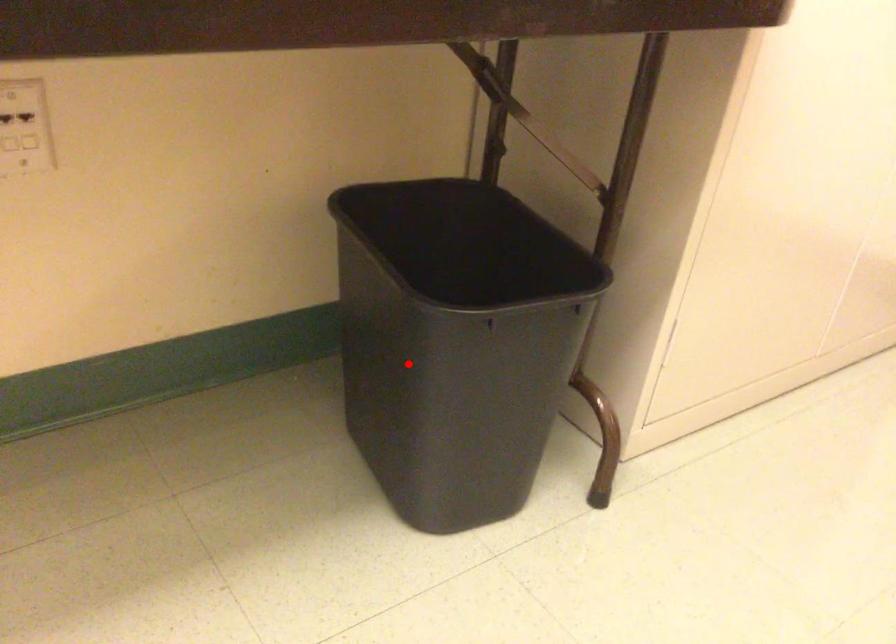
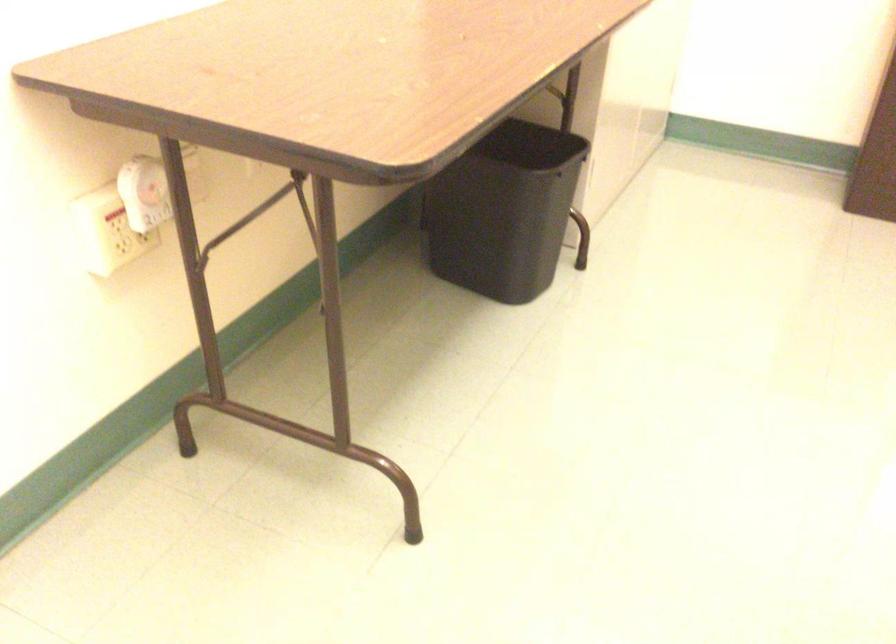
The point at the highlighted location is marked in the first image. Where is the corresponding point in the second image?

(504, 211)